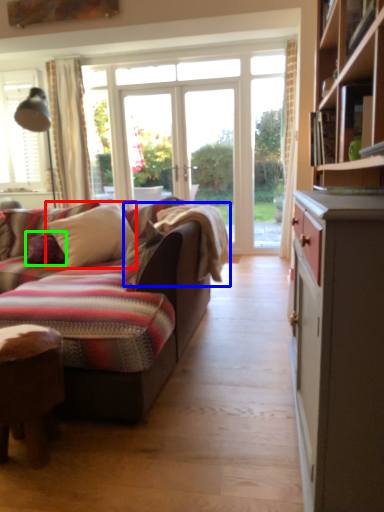
Question: Estimate the real-world distances between objects in this image. Which object is closer to pillow (highlighted by a red box), blanket (highlighted by a blue box) or pillow (highlighted by a green box)?

Choices:
 (A) blanket
 (B) pillow

Answer: (B)